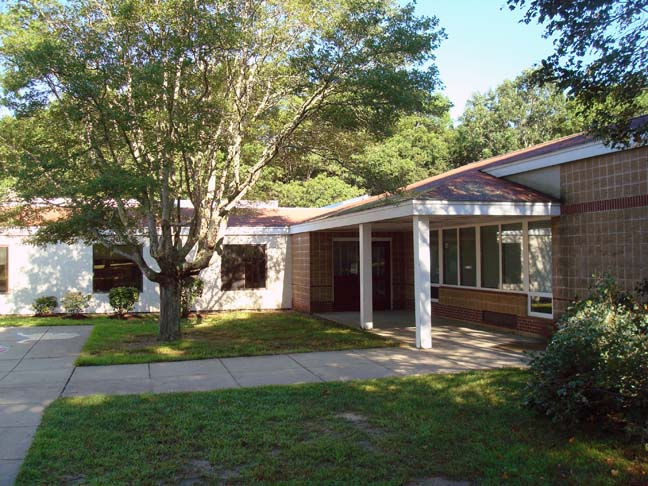
Identify the location of red brick wall. Image resolution: width=648 pixels, height=486 pixels. (621, 253), (607, 178), (486, 297), (317, 263), (297, 262).